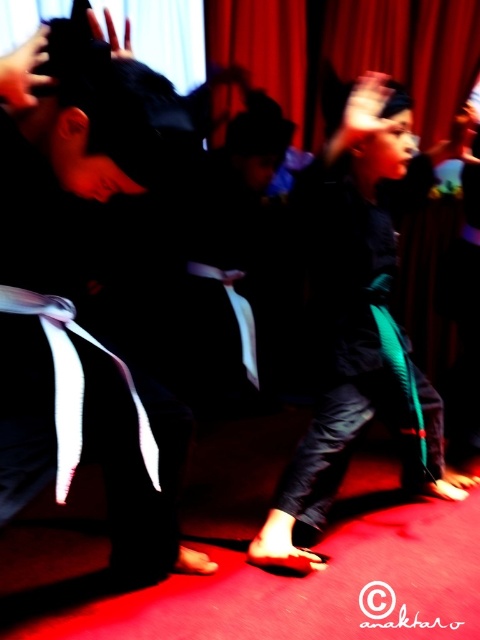
Which is more to the right, matte black belt at left or teal fabric pants at center?

Positioned to the right is teal fabric pants at center.

Describe the element at coordinates (81, 291) in the screenshot. I see `matte black belt at left` at that location.

You are a GUI agent. You are given a task and a screenshot of the screen. Output one action in this format:
    pyautogui.click(x=<x>, y=<y>)
    Task: Click on the matte black belt at left
    The width and height of the screenshot is (480, 640).
    Given the screenshot: What is the action you would take?
    pyautogui.click(x=81, y=291)

At what (x,y) coordinates should I click in order to perform the action: click on matte black belt at left. Please return your answer as a coordinate pair (x, y). Looking at the image, I should click on (81, 291).